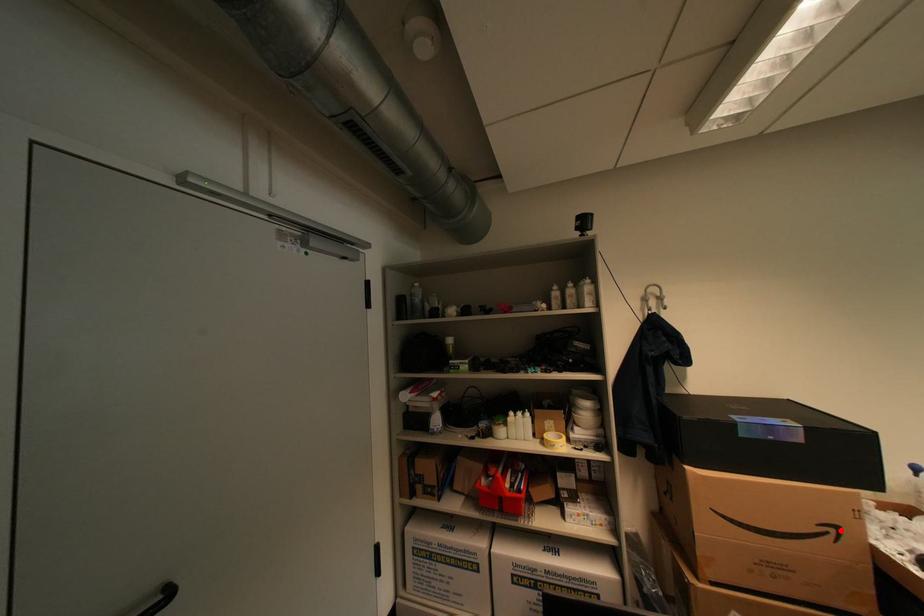
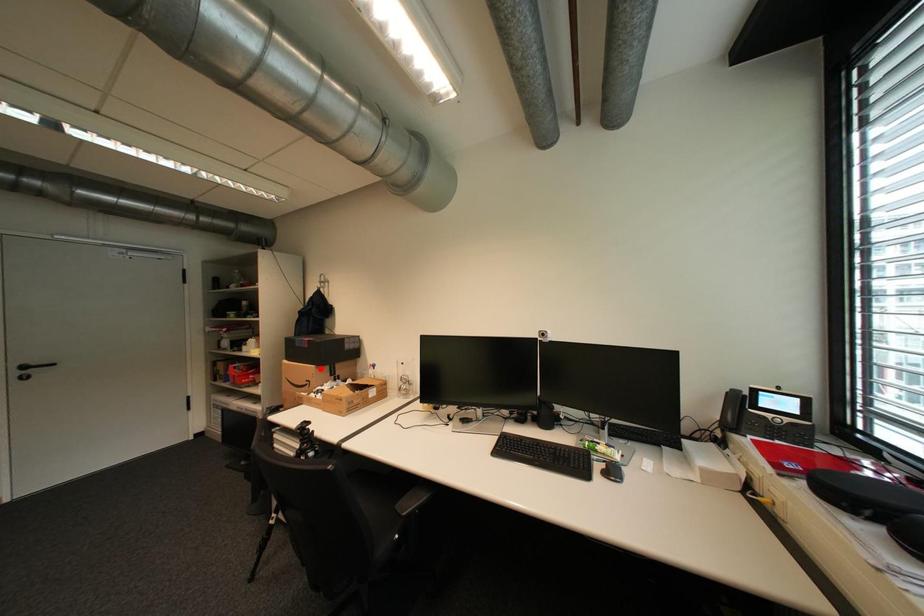
I am providing you with two images of the same scene from different viewpoints. A red point is marked on the first image and another point is marked on the second image. Is the red point in image1 aligned with the point shown in image2?

No